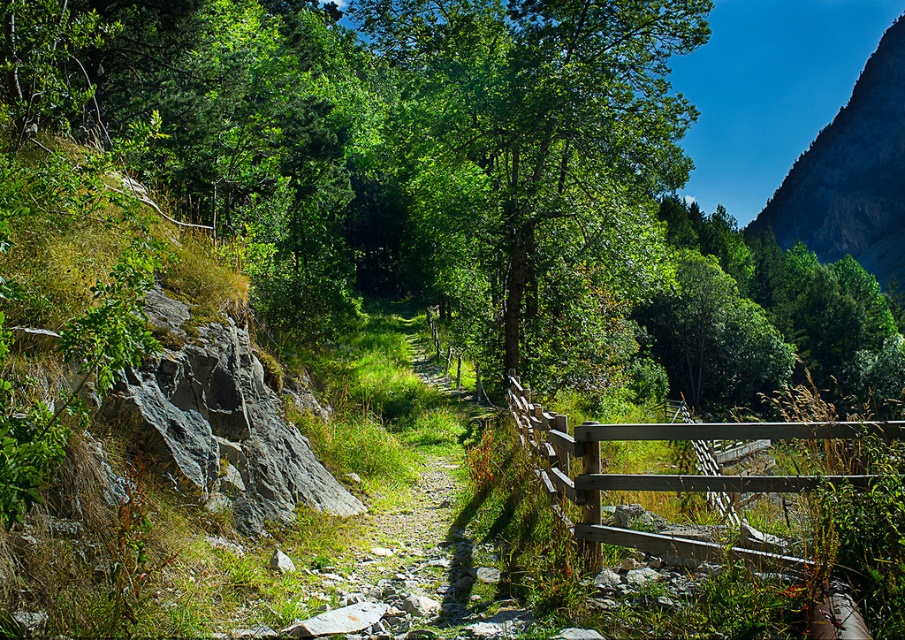
Question: Which point appears farthest from the camera in this image?

Choices:
 (A) (x=853, y=104)
 (B) (x=882, y=372)

Answer: (A)

Question: Which of these objects is positioned farthest from the green leafy tree at upper center?

Choices:
 (A) wooden gate at center
 (B) green leafy tree at center

Answer: (A)

Question: Can you confirm if green leafy tree at center is positioned below green leafy tree at upper center?

Choices:
 (A) yes
 (B) no

Answer: (B)

Question: Among these objects, which one is farthest from the camera?

Choices:
 (A) green leafy tree at center
 (B) wooden gate at center
 (C) green leafy tree at upper center

Answer: (C)

Question: Can you confirm if rocky cliff at upper right is thinner than wooden gate at center?

Choices:
 (A) no
 (B) yes

Answer: (A)

Question: Is rocky cliff at upper right positioned before wooden gate at center?

Choices:
 (A) yes
 (B) no

Answer: (B)